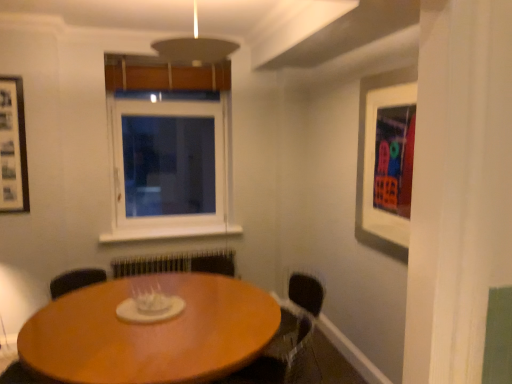
This screenshot has height=384, width=512. What are the coordinates of `vacant area situated below white plastic window at center (from a real-world perspective)` in the screenshot? It's located at (169, 225).